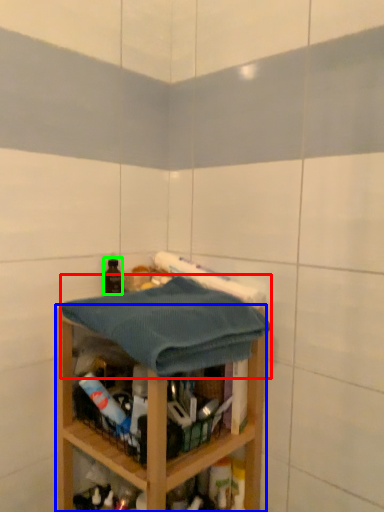
Question: Which is farther away from bath towel (highlighted by a red box)? shelf (highlighted by a blue box) or bottle (highlighted by a green box)?

Choices:
 (A) shelf
 (B) bottle

Answer: (B)